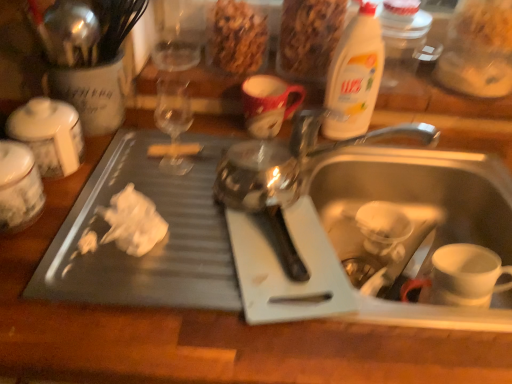
This screenshot has width=512, height=384. Identify the location of vacant area that is situated to the right of white plastic bottle at upper right. (423, 146).